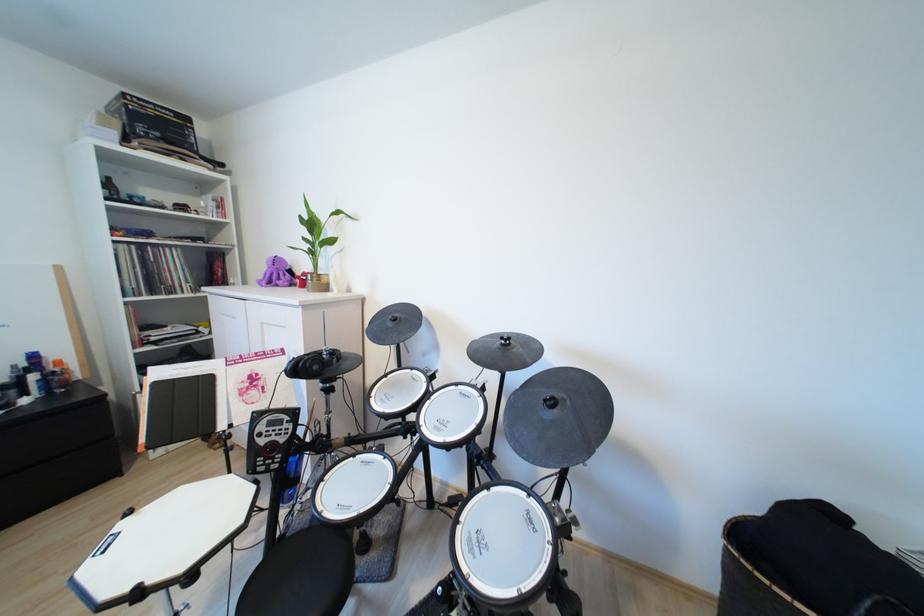
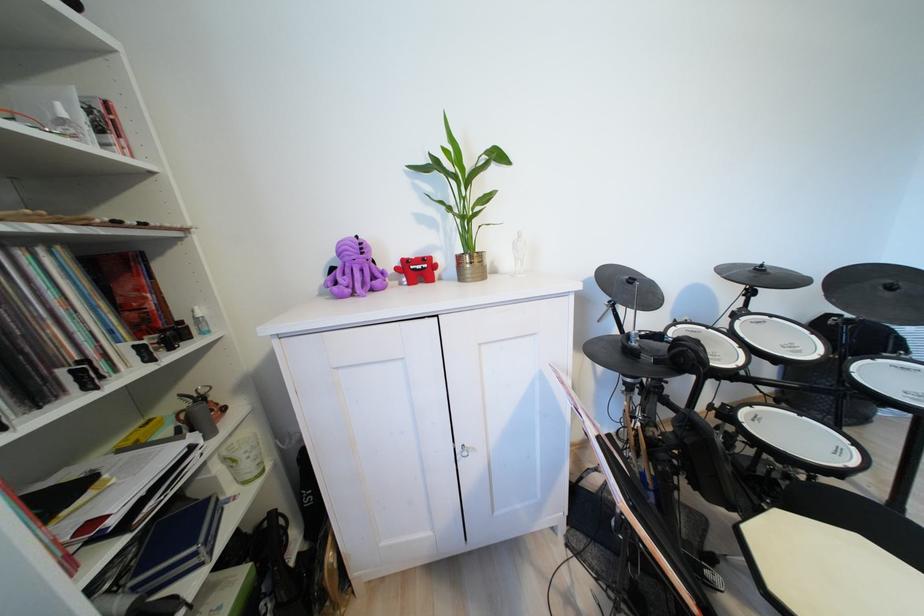
Locate, in the second image, the point that corresponds to point (560, 405) in the first image.

(897, 289)